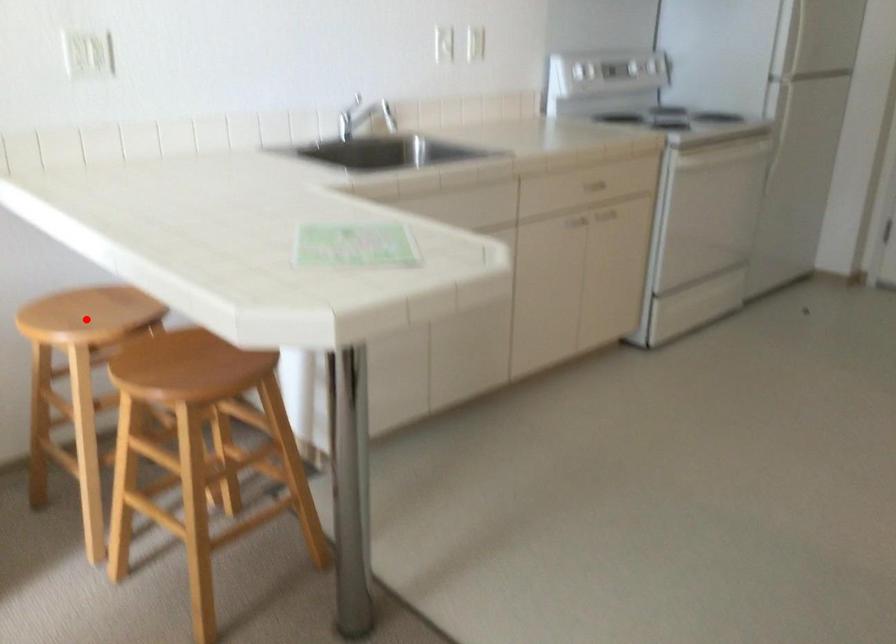
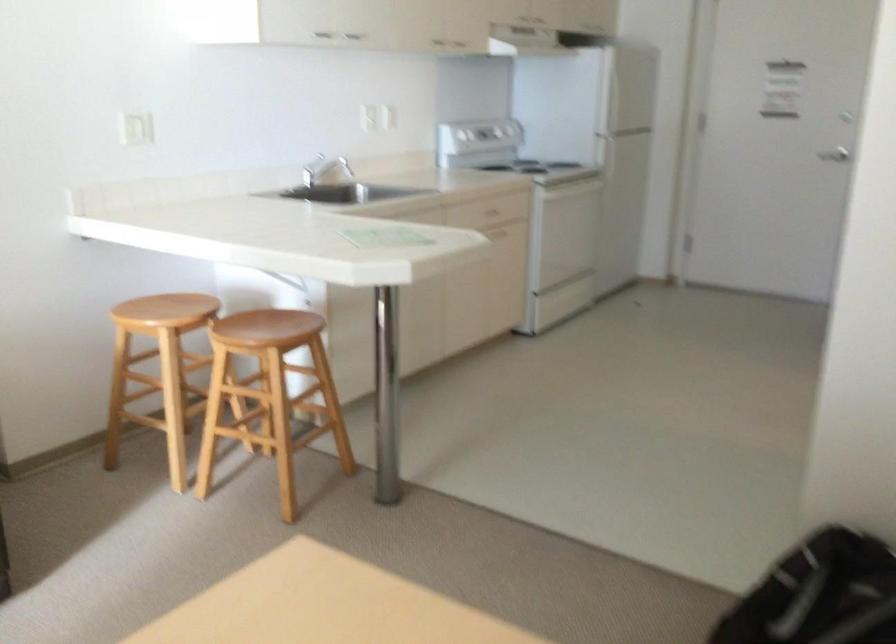
Find the pixel in the second image that matches the highlighted location in the first image.

(165, 310)